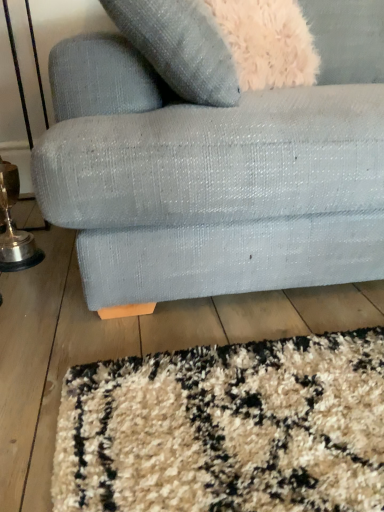
Locate an element on the screen. This screenshot has height=512, width=384. free space in front of gold metallic table lamp at lower left is located at coordinates (25, 289).